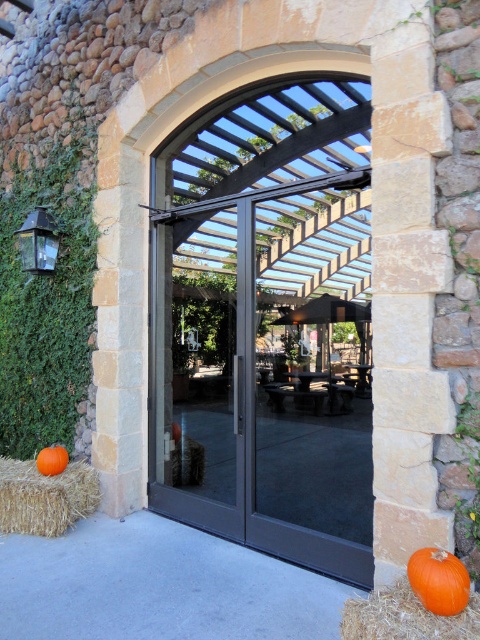
Does straw bale at lower left appear on the left side of orange matte pumpkin at lower right?

Indeed, straw bale at lower left is positioned on the left side of orange matte pumpkin at lower right.

Does straw bale at lower left have a greater width compared to orange matte pumpkin at lower right?

Correct, the width of straw bale at lower left exceeds that of orange matte pumpkin at lower right.

Who is more forward, (70, 483) or (443, 566)?

Point (443, 566)

Where is `straw bale at lower left`? straw bale at lower left is located at coordinates (45, 497).

Is orange matte pumpkin at lower right to the right of orange matte pumpkin at lower left from the viewer's perspective?

Yes, orange matte pumpkin at lower right is to the right of orange matte pumpkin at lower left.

Can you confirm if orange matte pumpkin at lower right is wider than orange matte pumpkin at lower left?

Incorrect, orange matte pumpkin at lower right's width does not surpass orange matte pumpkin at lower left's.

Find the location of a particular element. This screenshot has width=480, height=640. orange matte pumpkin at lower right is located at coordinates (439, 580).

Where is `orange matte pumpkin at lower right`? This screenshot has width=480, height=640. orange matte pumpkin at lower right is located at coordinates (439, 580).

Can you confirm if black glass door at center is smaller than straw bale at lower left?

No.

Who is higher up, black glass door at center or straw bale at lower left?

Positioned higher is black glass door at center.

Does point (265, 317) lie behind point (72, 497)?

Yes.

You are a GUI agent. You are given a task and a screenshot of the screen. Output one action in this format:
    pyautogui.click(x=<x>, y=<y>)
    Task: Click on the black glass door at center
    The width and height of the screenshot is (480, 640).
    Given the screenshot: What is the action you would take?
    pyautogui.click(x=266, y=324)